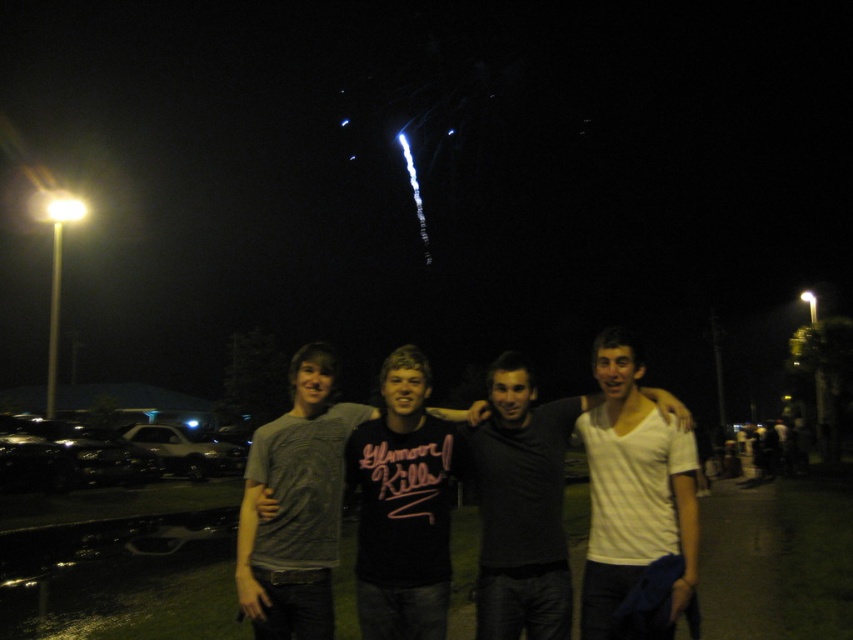
How much distance is there between white matte shirt at center and dark gray t-shirt at center?

white matte shirt at center and dark gray t-shirt at center are 17.89 inches apart.

Can you confirm if white matte shirt at center is positioned below dark gray t-shirt at center?

No, white matte shirt at center is not below dark gray t-shirt at center.

Who is more distant from viewer, (527, 364) or (381, 390)?

Positioned behind is point (381, 390).

Image resolution: width=853 pixels, height=640 pixels. In order to click on white matte shirt at center in this screenshot , I will do `click(520, 502)`.